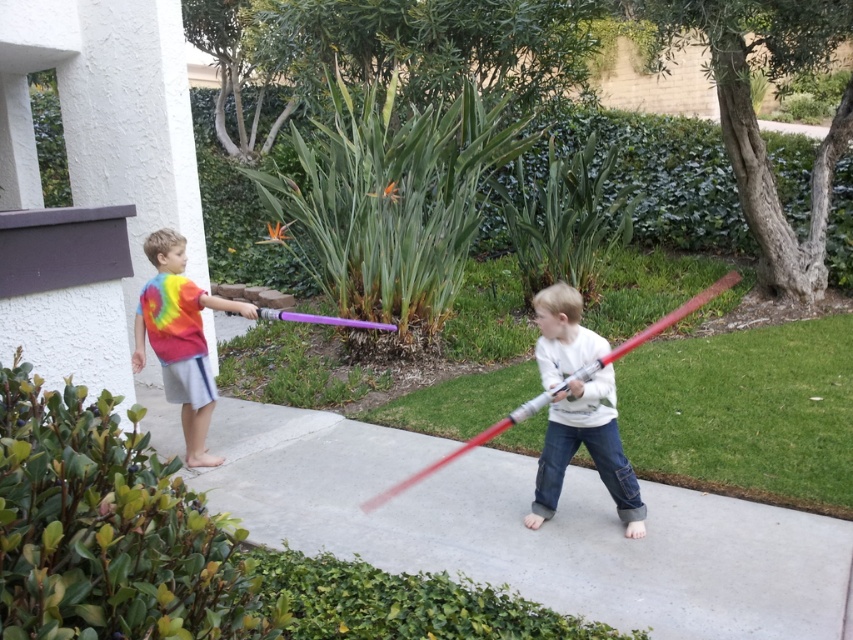
Question: Does matte white sweater at center come in front of rainbow tie-dye shirt at left?

Choices:
 (A) no
 (B) yes

Answer: (B)

Question: Among these objects, which one is nearest to the camera?

Choices:
 (A) shiny red plastic bat at center
 (B) matte white sweater at center

Answer: (A)

Question: Estimate the real-world distances between objects in this image. Which object is farther from the rainbow tie-dye shirt at left?

Choices:
 (A) matte white sweater at center
 (B) smooth concrete sidewalk at center

Answer: (A)

Question: In this image, where is matte white sweater at center located relative to shiny red plastic bat at center?

Choices:
 (A) above
 (B) below

Answer: (B)

Question: Is matte white sweater at center positioned in front of rainbow tie-dye shirt at left?

Choices:
 (A) yes
 (B) no

Answer: (A)

Question: Which of the following is the closest to the observer?

Choices:
 (A) (625, 516)
 (B) (635, 344)
 (C) (833, 572)
 (D) (194, 291)

Answer: (C)